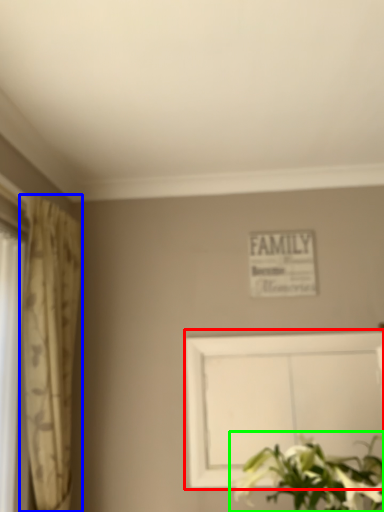
Question: Considering the real-world distances, which object is farthest from picture frame (highlighted by a red box)? curtain (highlighted by a blue box) or floral arrangement (highlighted by a green box)?

Choices:
 (A) curtain
 (B) floral arrangement

Answer: (A)